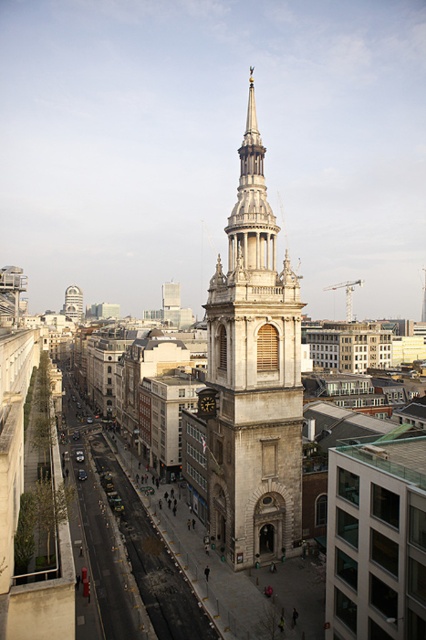
Between stone tower at center and stone clock tower at center, which one is positioned higher?

stone clock tower at center

Does stone tower at center have a lesser width compared to stone clock tower at center?

Yes, stone tower at center is thinner than stone clock tower at center.

The width and height of the screenshot is (426, 640). What do you see at coordinates (253, 378) in the screenshot?
I see `stone tower at center` at bounding box center [253, 378].

What are the coordinates of `stone tower at center` in the screenshot? It's located at (253, 378).